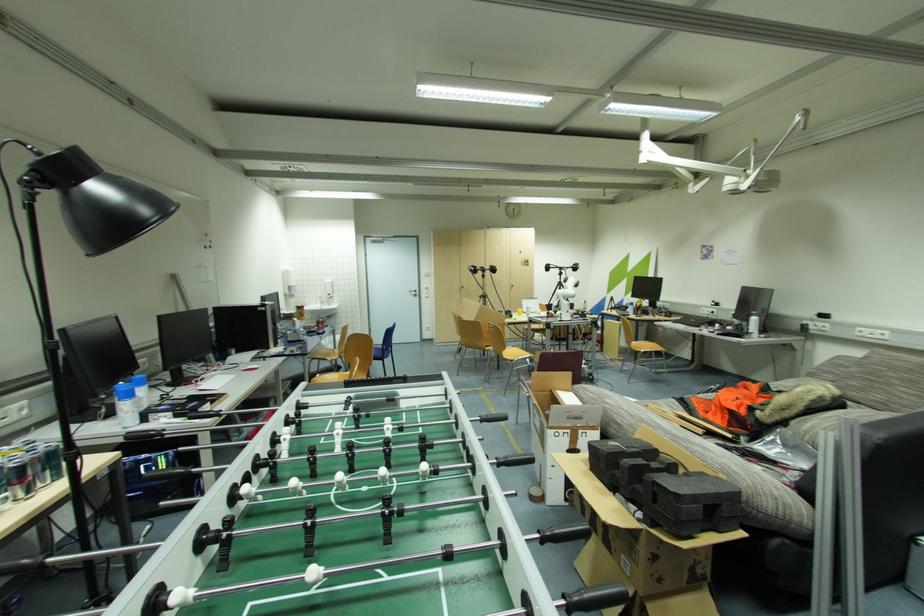
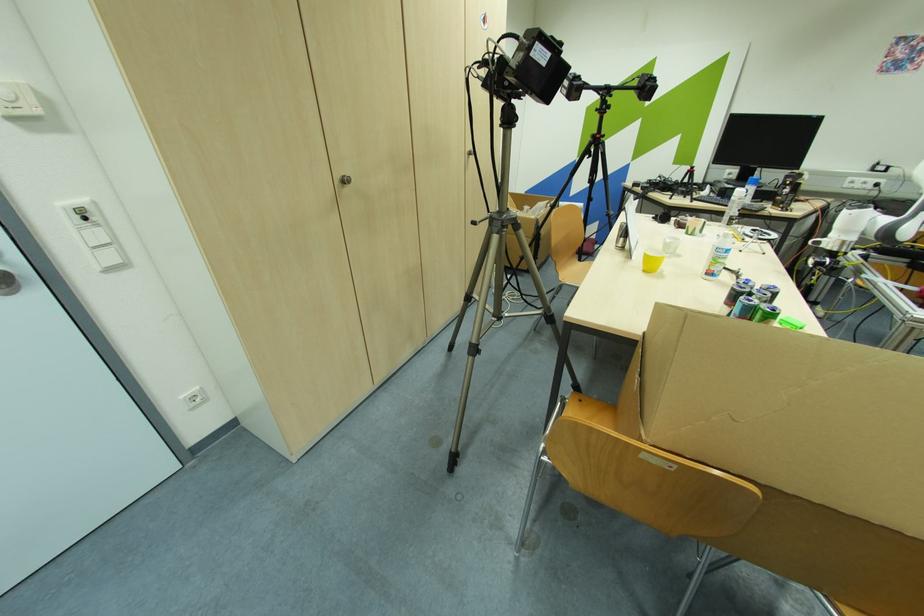
The point at (x=485, y=294) is marked in the first image. Where is the corresponding point in the second image?

(504, 214)